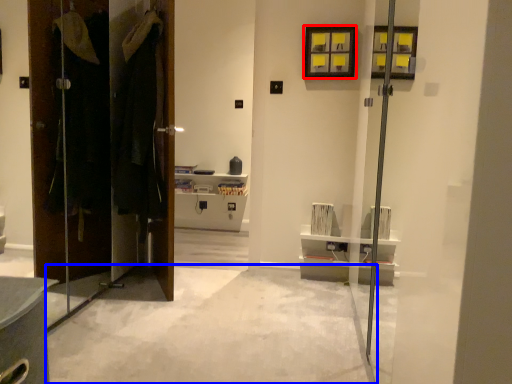
Question: Among these objects, which one is nearest to the camera, window (highlighted by a red box) or concrete (highlighted by a blue box)?

Choices:
 (A) window
 (B) concrete

Answer: (B)